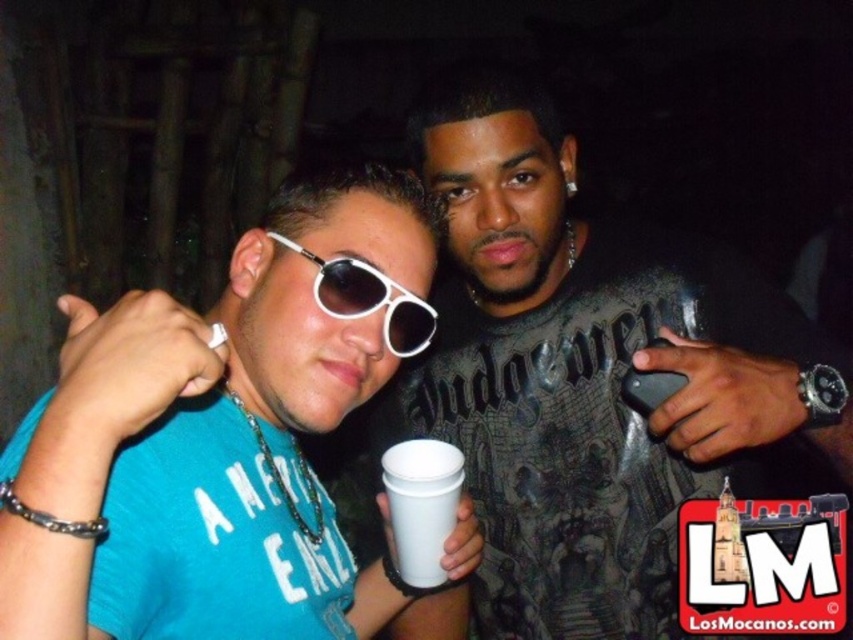
Question: Does matte black shirt at center lie in front of matte white sunglasses at center?

Choices:
 (A) yes
 (B) no

Answer: (B)

Question: Can you confirm if matte white sunglasses at center is positioned to the right of white plastic sunglasses at center?

Choices:
 (A) yes
 (B) no

Answer: (B)

Question: Which of the following is the closest to the observer?

Choices:
 (A) white paper cup at center
 (B) matte black shirt at center
 (C) white plastic sunglasses at center

Answer: (B)

Question: Which object is farther from the camera taking this photo?

Choices:
 (A) white plastic sunglasses at center
 (B) matte black shirt at center
 (C) white paper cup at center
 (D) matte white sunglasses at center

Answer: (C)

Question: Is white paper cup at center bigger than white plastic sunglasses at center?

Choices:
 (A) yes
 (B) no

Answer: (B)

Question: Considering the real-world distances, which object is closest to the matte black shirt at center?

Choices:
 (A) white plastic sunglasses at center
 (B) white paper cup at center
 (C) matte white sunglasses at center

Answer: (B)